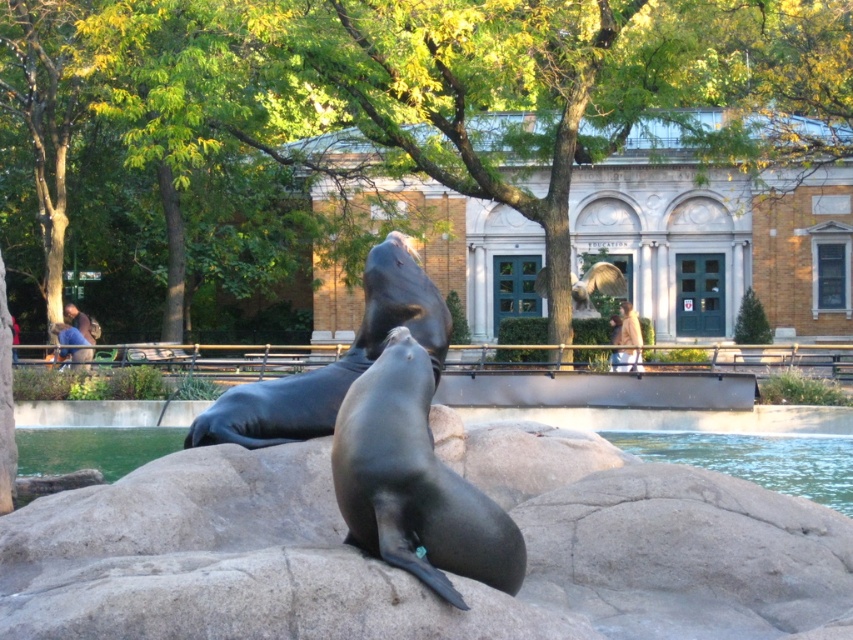
You are a zookeeper observing the two seals in the image. You notice both the shiny black seal at center and the black rubber seal at center. Which one is located above the other?

The shiny black seal at center is positioned over the black rubber seal at center, so it is above the other.

You are designing a zoo enclosure and need to place two seals in the image. The shiny black seal at center and the black rubber seal at center must be placed on a platform. The platform can only support a maximum width of 1.2 meters. Can both seals fit side by side on the platform without overlapping?

The shiny black seal at center has a width less than the black rubber seal at center. Since the platform can support up to 1.2 meters, we need to know the combined width of both seals. However, the exact widths arenot provided, only that the shiny black seal is narrower. Without specific measurements, it is impossible to determine if their combined width exceeds the platform limit. Therefore, it is uncertain if both can fit side by side without overlapping.